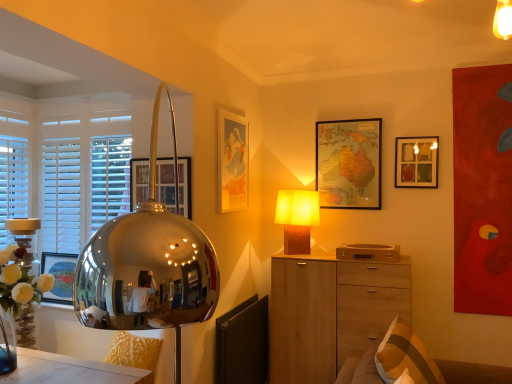
Question: Does matte wooden picture frame at upper right, the 3th picture frame from the front, have a greater height compared to wooden chest of drawers at center?

Choices:
 (A) yes
 (B) no

Answer: (B)

Question: Is wooden chest of drawers at center located within matte wooden picture frame at upper right, placed as the 1th picture frame when sorted from right to left?

Choices:
 (A) no
 (B) yes

Answer: (A)

Question: From a real-world perspective, is matte wooden picture frame at upper right, the 2th picture frame viewed from the back, under wooden chest of drawers at center?

Choices:
 (A) no
 (B) yes

Answer: (A)

Question: Would you consider matte wooden picture frame at upper right, which ranks as the 4th picture frame in left-to-right order, to be distant from wooden chest of drawers at center?

Choices:
 (A) yes
 (B) no

Answer: (A)

Question: Does matte wooden picture frame at upper right, the 3th picture frame from the front, have a smaller size compared to wooden chest of drawers at center?

Choices:
 (A) yes
 (B) no

Answer: (A)

Question: In terms of width, does matte paper poster at upper center, which is counted as the 2th picture frame, starting from the front, look wider or thinner when compared to metallic gold swivel chair at lower left?

Choices:
 (A) wide
 (B) thin

Answer: (B)

Question: In the image, is matte paper poster at upper center, which ranks as the 2th picture frame in left-to-right order, positioned in front of or behind metallic gold swivel chair at lower left?

Choices:
 (A) behind
 (B) front

Answer: (A)

Question: Is point (223, 168) closer or farther from the camera than point (144, 367)?

Choices:
 (A) closer
 (B) farther

Answer: (B)

Question: Based on their positions, is matte paper poster at upper center, which is counted as the 2th picture frame, starting from the front, located to the left or right of metallic gold swivel chair at lower left?

Choices:
 (A) right
 (B) left

Answer: (A)

Question: Based on their positions, is matte yellow fabric lampshade at center located to the left or right of metallic glass picture frame at upper left, which ranks as the fourth picture frame in right-to-left order?

Choices:
 (A) left
 (B) right

Answer: (B)

Question: In terms of width, does matte yellow fabric lampshade at center look wider or thinner when compared to metallic glass picture frame at upper left, the 1th picture frame from the front?

Choices:
 (A) wide
 (B) thin

Answer: (A)

Question: From a real-world perspective, is matte yellow fabric lampshade at center positioned above or below metallic glass picture frame at upper left, acting as the fourth picture frame starting from the back?

Choices:
 (A) below
 (B) above

Answer: (A)

Question: From their relative heights in the image, would you say matte yellow fabric lampshade at center is taller or shorter than metallic glass picture frame at upper left, which ranks as the fourth picture frame in right-to-left order?

Choices:
 (A) short
 (B) tall

Answer: (B)

Question: Is wooden chest of drawers at center taller or shorter than map paper at upper center, the 1th picture frame from the back?

Choices:
 (A) tall
 (B) short

Answer: (A)

Question: Is wooden chest of drawers at center bigger or smaller than map paper at upper center, which is the 2th picture frame from right to left?

Choices:
 (A) small
 (B) big

Answer: (B)